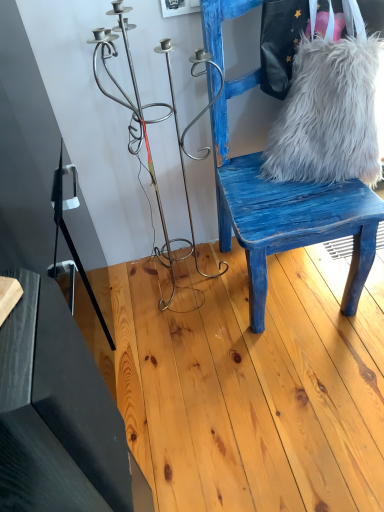
Question: Considering their positions, is white fluffy fur at right located in front of or behind black matte table at lower left?

Choices:
 (A) front
 (B) behind

Answer: (B)

Question: Is white fluffy fur at right spatially inside black matte table at lower left, or outside of it?

Choices:
 (A) outside
 (B) inside

Answer: (A)

Question: Which object is positioned closest to the blue distressed wood chair at right?

Choices:
 (A) white fluffy fur at right
 (B) black matte table at lower left
 (C) white fluffy bag at right

Answer: (A)

Question: Which is nearer to the blue distressed wood chair at right?

Choices:
 (A) white fluffy bag at right
 (B) black matte table at lower left
 (C) white fluffy fur at right

Answer: (C)